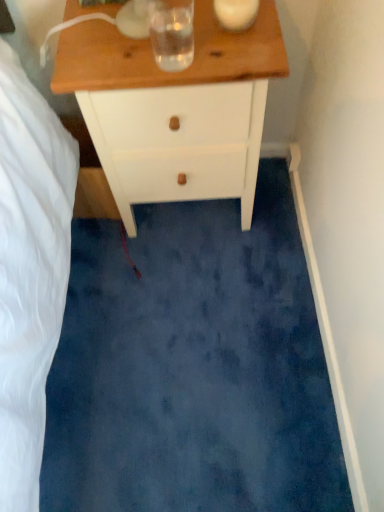
Identify the location of vacant area situated to the left side of clear glass water at upper center. This screenshot has height=512, width=384. (104, 57).